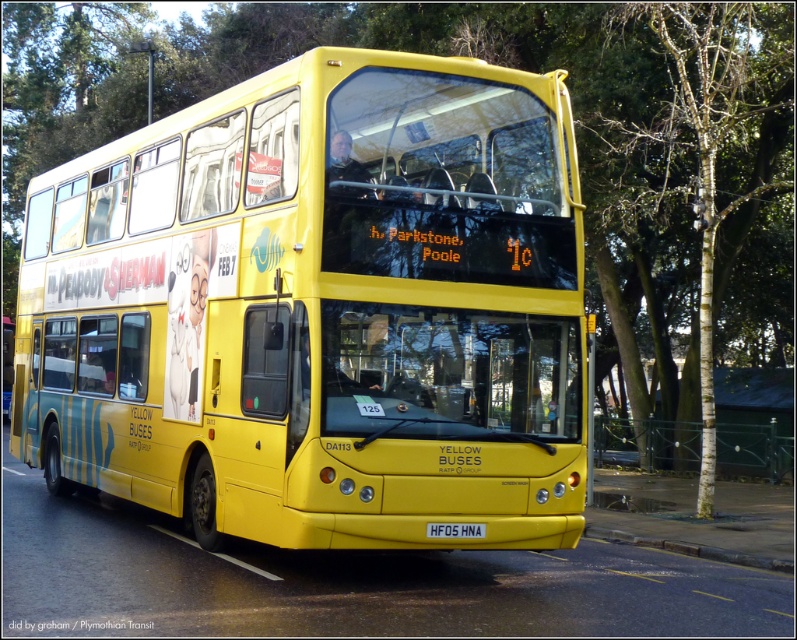
From the picture: You are standing in front of the Yellow Buses double decker bus and want to touch both points on the bus. The first point is at coordinate point (283, 136) and the second point is at coordinate point (464, 538). Which point will you reach first if you start moving towards the bus?

Point (283, 136) is further to the camera than point (464, 538), so you will reach point (283, 136) first because it is closer to you.